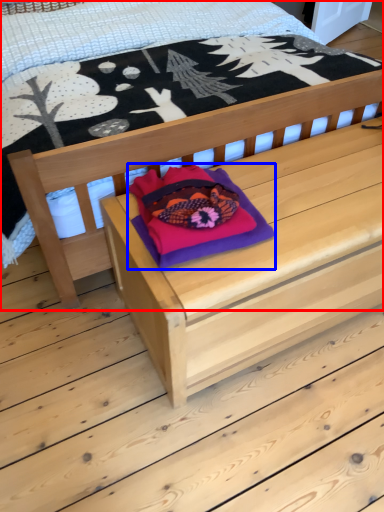
Question: Which object is closer to the camera taking this photo, bed (highlighted by a red box) or throw pillow (highlighted by a blue box)?

Choices:
 (A) bed
 (B) throw pillow

Answer: (A)